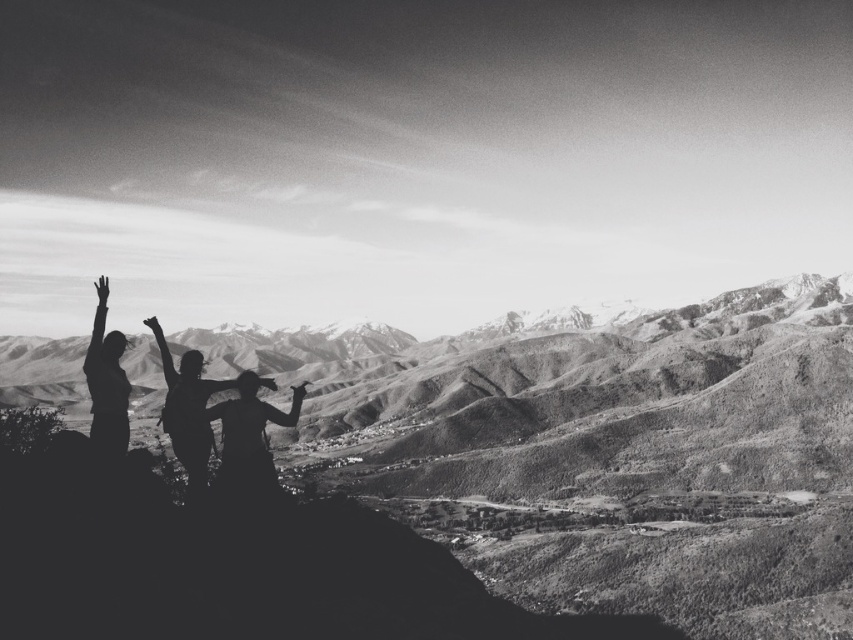
You are standing at the point labeled point (148, 323) and want to see the distant mountains. If you walk towards point (305, 385), will you get a better view?

Yes, because point (305, 385) is behind point (148, 323), so moving towards it would place you further back, potentially offering a better vantage point to see the distant mountains.

You are standing at the center of the hilltop scene. You notice two points marked in the image. The first point is located at coordinates point (x=97, y=323) and the second at point (x=158, y=328). Which of these two points is closer to you?

Point (x=97, y=323) is in front of point (x=158, y=328), so it is closer to you.